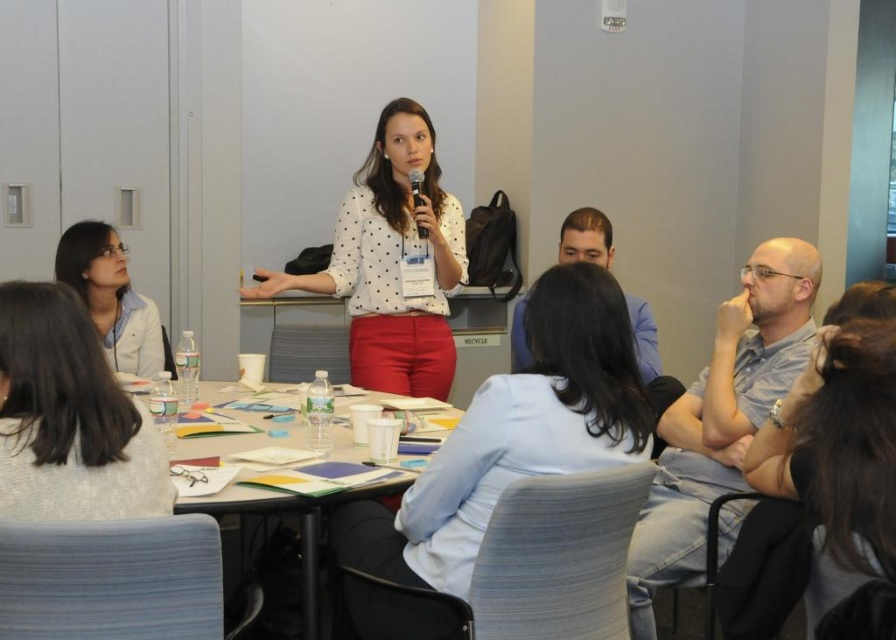
Question: Can you confirm if dark brown hair at lower right is positioned below white dotted shirt at center?

Choices:
 (A) yes
 (B) no

Answer: (A)

Question: Can you confirm if dark brown hair at lower right is wider than matte black microphone at center?

Choices:
 (A) no
 (B) yes

Answer: (B)

Question: Which point is closer to the camera taking this photo?

Choices:
 (A) (362, 312)
 (B) (800, 474)

Answer: (B)

Question: Which is nearer to the matte white coat at left?

Choices:
 (A) white dotted shirt at center
 (B) matte black microphone at center

Answer: (A)

Question: Which object appears closest to the camera in this image?

Choices:
 (A) white dotted shirt at center
 (B) matte white coat at left

Answer: (A)

Question: Where is gray knit sweater at lower left located in relation to matte black microphone at center in the image?

Choices:
 (A) left
 (B) right

Answer: (A)